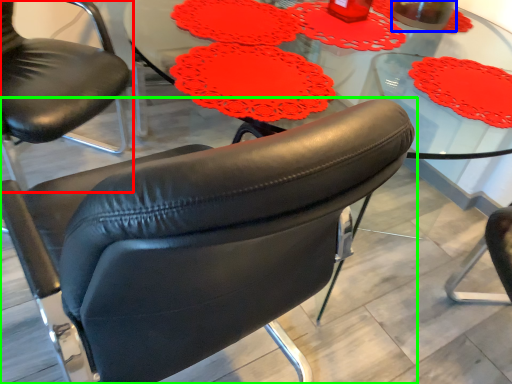
Question: Considering the real-world distances, which object is closest to chair (highlighted by a red box)? beverage (highlighted by a blue box) or chair (highlighted by a green box).

Choices:
 (A) beverage
 (B) chair

Answer: (B)